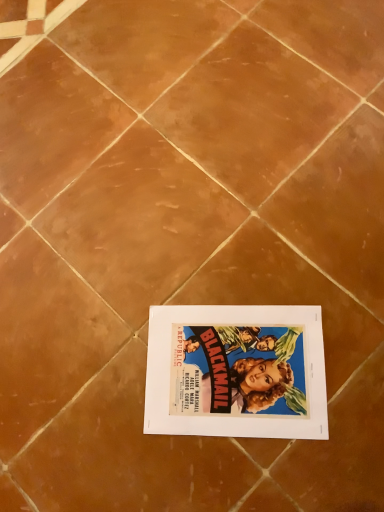
Locate an element on the screen. This screenshot has height=512, width=384. vacant space in white paper at center (from a real-world perspective) is located at coordinates [x=228, y=370].